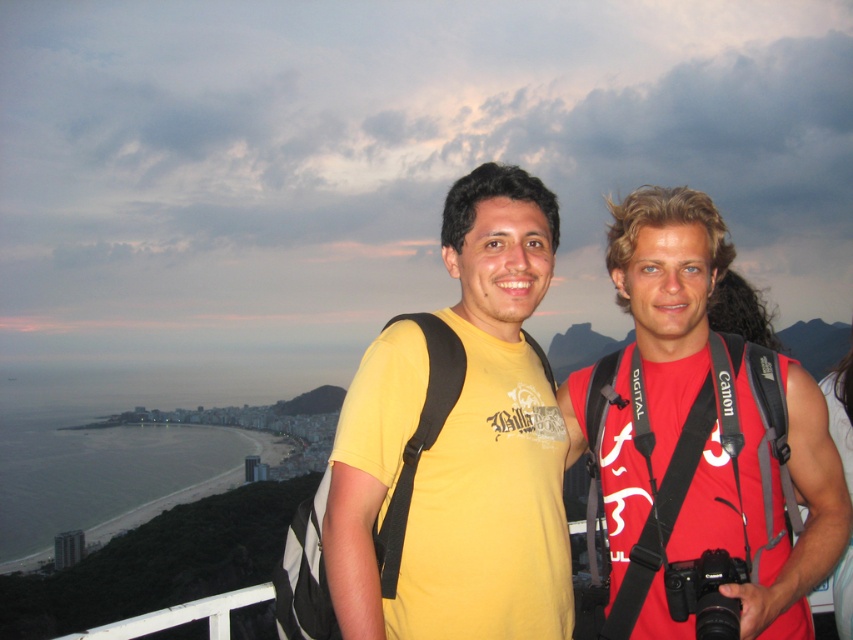
Which is behind, point (556, 451) or point (724, 264)?

Point (724, 264)

Looking at this image, who is higher up, yellow matte t-shirt at center or red matte shirt at center?

yellow matte t-shirt at center is above.

Which is in front, point (393, 419) or point (701, 236)?

Positioned in front is point (393, 419).

Locate an element on the screen. yellow matte t-shirt at center is located at coordinates (461, 444).

Does yellow matte t-shirt at center have a greater height compared to black plastic camera at center?

Correct, yellow matte t-shirt at center is much taller as black plastic camera at center.

Is point (473, 275) closer to camera compared to point (701, 556)?

That is False.

Is point (410, 534) in front of point (729, 636)?

No.

This screenshot has width=853, height=640. I want to click on yellow matte t-shirt at center, so click(461, 444).

At what (x,y) coordinates should I click in order to perform the action: click on red matte shirt at center. Please return your answer as a coordinate pair (x, y). Looking at the image, I should click on (656, 340).